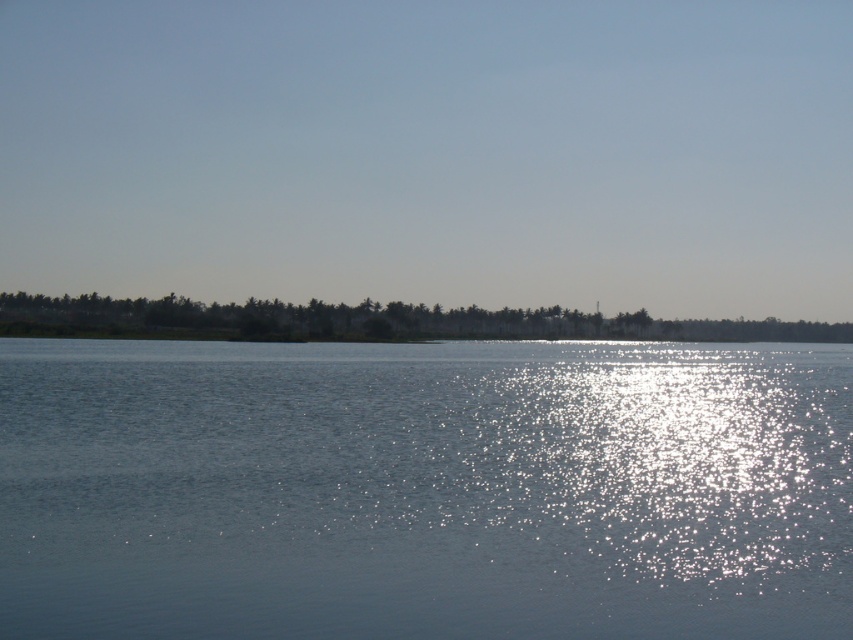
You are standing at the point labeled point [672,512] and want to walk towards the point labeled point [126,308]. Given that both points are on the water surface, which direction should you head towards?

You should head towards the lower left direction because point [126,308] is located to the lower left of point [672,512].

You are a photographer trying to capture the reflection of the trees in the clear water at center. Based on the scene description, where should you position your camera to ensure the reflection is visible? Please provide coordinates as a point in the format of x,y between 0 and 1.

The clear water at center is located at point (424,490). To capture the reflection of the trees, position the camera at this coordinate to ensure the reflection is visible in the clear water at center.